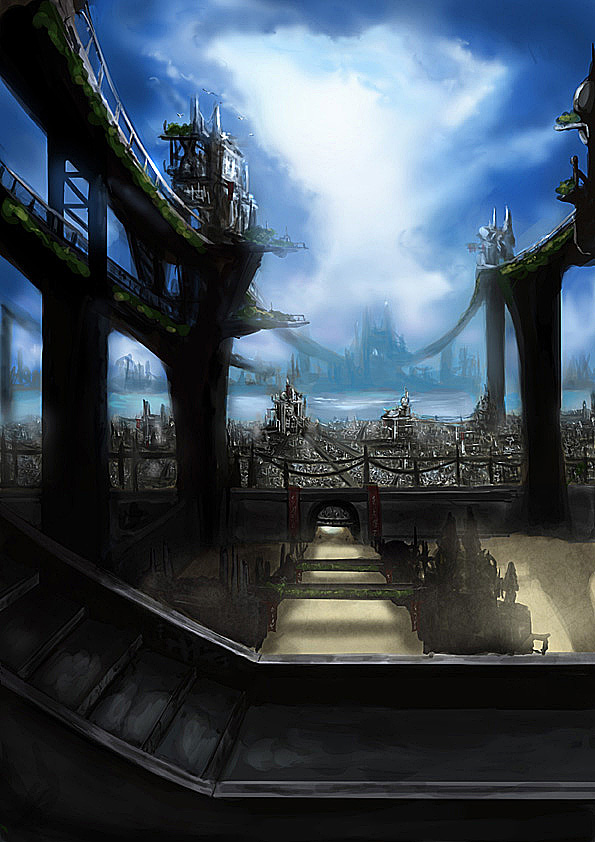
Image resolution: width=595 pixels, height=842 pixels. Find the location of `stairs`. stairs is located at coordinates click(156, 694).